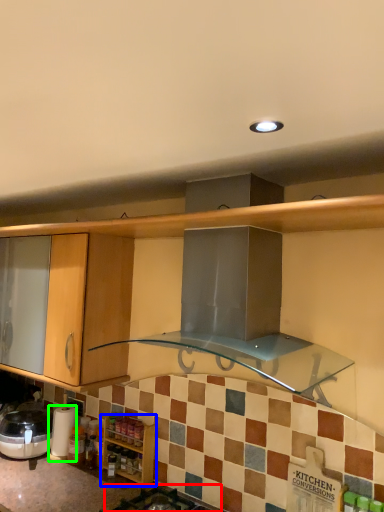
Question: Estimate the real-world distances between objects in this image. Which object is farther from gas stove (highlighted by a red box), cabinetry (highlighted by a blue box) or appliance (highlighted by a green box)?

Choices:
 (A) cabinetry
 (B) appliance

Answer: (B)